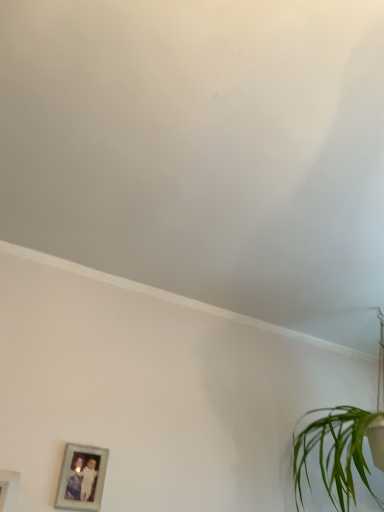
Locate an element on the screen. white matte picture frame at lower left, the 2th picture frame viewed from the back is located at coordinates (8, 489).

You are a GUI agent. You are given a task and a screenshot of the screen. Output one action in this format:
    pyautogui.click(x=<x>, y=<y>)
    Task: Click on the white matte wall at upper center
    This screenshot has height=512, width=384.
    Given the screenshot: What is the action you would take?
    pyautogui.click(x=204, y=151)

The image size is (384, 512). I want to click on silver metallic photo frame at lower left, the second picture frame from the front, so click(x=82, y=478).

Can you confirm if white matte wall at upper center is thinner than green leafy plant at lower right?

No.

Relative to green leafy plant at lower right, is white matte wall at upper center in front or behind?

Visually, white matte wall at upper center is located in front of green leafy plant at lower right.

Is point (169, 145) positioned after point (353, 500)?

That is False.

Is white matte wall at upper center aimed at green leafy plant at lower right?

No, white matte wall at upper center is not facing towards green leafy plant at lower right.

Is green leafy plant at lower right bigger or smaller than silver metallic photo frame at lower left, the second picture frame from the front?

Clearly, green leafy plant at lower right is larger in size than silver metallic photo frame at lower left, the second picture frame from the front.

Which is in front, green leafy plant at lower right or silver metallic photo frame at lower left, arranged as the 1th picture frame when viewed from the right?

green leafy plant at lower right.

Is point (373, 422) closer to viewer compared to point (87, 477)?

No, (373, 422) is further to viewer.

Would you say green leafy plant at lower right is a long distance from silver metallic photo frame at lower left, the first picture frame in the back-to-front sequence?

No, there isn't a large distance between green leafy plant at lower right and silver metallic photo frame at lower left, the first picture frame in the back-to-front sequence.

Is green leafy plant at lower right not close to white matte picture frame at lower left, which is counted as the 2th picture frame, starting from the right?

green leafy plant at lower right is far away from white matte picture frame at lower left, which is counted as the 2th picture frame, starting from the right.

Which of these two, green leafy plant at lower right or white matte picture frame at lower left, which is the first picture frame from front to back, stands taller?

green leafy plant at lower right is taller.

Image resolution: width=384 pixels, height=512 pixels. What are the coordinates of `houseplant on the right of white matte picture frame at lower left, which is counted as the 2th picture frame, starting from the right` in the screenshot? It's located at (342, 445).

Considering the relative sizes of green leafy plant at lower right and white matte picture frame at lower left, which is counted as the 2th picture frame, starting from the right, in the image provided, is green leafy plant at lower right smaller than white matte picture frame at lower left, which is counted as the 2th picture frame, starting from the right,?

Actually, green leafy plant at lower right might be larger than white matte picture frame at lower left, which is counted as the 2th picture frame, starting from the right.

Considering the sizes of white matte picture frame at lower left, the 1th picture frame from the left, and silver metallic photo frame at lower left, arranged as the 1th picture frame when viewed from the right, in the image, is white matte picture frame at lower left, the 1th picture frame from the left, taller or shorter than silver metallic photo frame at lower left, arranged as the 1th picture frame when viewed from the right,?

Considering their sizes, white matte picture frame at lower left, the 1th picture frame from the left, has more height than silver metallic photo frame at lower left, arranged as the 1th picture frame when viewed from the right.

Looking at the image, does white matte picture frame at lower left, the 1th picture frame from the left, seem bigger or smaller compared to silver metallic photo frame at lower left, the 2th picture frame in the left-to-right sequence?

Considering their sizes, white matte picture frame at lower left, the 1th picture frame from the left, takes up more space than silver metallic photo frame at lower left, the 2th picture frame in the left-to-right sequence.

Does point (9, 487) lie behind point (73, 472)?

No, it is not.

In the image, there is a silver metallic photo frame at lower left, arranged as the 1th picture frame when viewed from the right. Where is `picture frame below it (from the image's perspective)`? picture frame below it (from the image's perspective) is located at coordinates (8, 489).

Locate an element on the screen. The image size is (384, 512). houseplant on the right of white matte picture frame at lower left, the 1th picture frame from the left is located at coordinates (342, 445).

Is white matte picture frame at lower left, which is the first picture frame from front to back, smaller than green leafy plant at lower right?

Yes, white matte picture frame at lower left, which is the first picture frame from front to back, is smaller than green leafy plant at lower right.

Which is more distant, (x=2, y=490) or (x=370, y=446)?

The point (x=370, y=446) is more distant.

In the image, is white matte picture frame at lower left, which is the first picture frame from front to back, positioned in front of or behind green leafy plant at lower right?

white matte picture frame at lower left, which is the first picture frame from front to back, is in front of green leafy plant at lower right.

Could silver metallic photo frame at lower left, arranged as the 1th picture frame when viewed from the right, be considered to be inside white matte wall at upper center?

That's incorrect, silver metallic photo frame at lower left, arranged as the 1th picture frame when viewed from the right, is not inside white matte wall at upper center.

Can you confirm if white matte wall at upper center is thinner than silver metallic photo frame at lower left, arranged as the 1th picture frame when viewed from the right?

No, white matte wall at upper center is not thinner than silver metallic photo frame at lower left, arranged as the 1th picture frame when viewed from the right.

Based on the photo, considering the positions of objects white matte wall at upper center and silver metallic photo frame at lower left, the second picture frame from the front, in the image provided, who is in front, white matte wall at upper center or silver metallic photo frame at lower left, the second picture frame from the front,?

white matte wall at upper center is in front.

Is white matte wall at upper center facing towards silver metallic photo frame at lower left, arranged as the 1th picture frame when viewed from the right?

No, white matte wall at upper center is not turned towards silver metallic photo frame at lower left, arranged as the 1th picture frame when viewed from the right.

In the scene shown: From a real-world perspective, is green leafy plant at lower right below white matte wall at upper center?

Yes, from a real-world perspective, green leafy plant at lower right is below white matte wall at upper center.

Can you confirm if green leafy plant at lower right is positioned to the left of white matte wall at upper center?

Incorrect, green leafy plant at lower right is not on the left side of white matte wall at upper center.

From the image's perspective, would you say green leafy plant at lower right is positioned over white matte wall at upper center?

No, from the image's perspective, green leafy plant at lower right is not on top of white matte wall at upper center.

You are a GUI agent. You are given a task and a screenshot of the screen. Output one action in this format:
    pyautogui.click(x=<x>, y=<y>)
    Task: Click on the cloud above the green leafy plant at lower right (from the image's perspective)
    The width and height of the screenshot is (384, 512).
    Given the screenshot: What is the action you would take?
    pyautogui.click(x=204, y=151)

Where is `picture frame that is behind the green leafy plant at lower right`? picture frame that is behind the green leafy plant at lower right is located at coordinates (82, 478).

Estimate the real-world distances between objects in this image. Which object is closer to green leafy plant at lower right, white matte picture frame at lower left, which is the first picture frame from front to back, or silver metallic photo frame at lower left, the 2th picture frame in the left-to-right sequence?

Among the two, silver metallic photo frame at lower left, the 2th picture frame in the left-to-right sequence, is located nearer to green leafy plant at lower right.

From the image, which object appears to be farther from silver metallic photo frame at lower left, the first picture frame in the back-to-front sequence, green leafy plant at lower right or white matte picture frame at lower left, the 1th picture frame from the left?

green leafy plant at lower right lies further to silver metallic photo frame at lower left, the first picture frame in the back-to-front sequence, than the other object.

Estimate the real-world distances between objects in this image. Which object is further from white matte wall at upper center, silver metallic photo frame at lower left, arranged as the 1th picture frame when viewed from the right, or green leafy plant at lower right?

The object further to white matte wall at upper center is silver metallic photo frame at lower left, arranged as the 1th picture frame when viewed from the right.

Which object lies further to the anchor point silver metallic photo frame at lower left, the 2th picture frame in the left-to-right sequence, white matte wall at upper center or white matte picture frame at lower left, which is counted as the 2th picture frame, starting from the right?

The object further to silver metallic photo frame at lower left, the 2th picture frame in the left-to-right sequence, is white matte wall at upper center.

Based on their spatial positions, is green leafy plant at lower right or white matte picture frame at lower left, the 2th picture frame viewed from the back, closer to white matte wall at upper center?

green leafy plant at lower right lies closer to white matte wall at upper center than the other object.

From the image, which object appears to be nearer to white matte picture frame at lower left, the 2th picture frame viewed from the back, white matte wall at upper center or silver metallic photo frame at lower left, the second picture frame from the front?

silver metallic photo frame at lower left, the second picture frame from the front, lies closer to white matte picture frame at lower left, the 2th picture frame viewed from the back, than the other object.

Based on their spatial positions, is white matte wall at upper center or white matte picture frame at lower left, which is counted as the 2th picture frame, starting from the right, closer to green leafy plant at lower right?

Based on the image, white matte wall at upper center appears to be nearer to green leafy plant at lower right.

Which object lies nearer to the anchor point silver metallic photo frame at lower left, the first picture frame in the back-to-front sequence, white matte picture frame at lower left, the 1th picture frame from the left, or green leafy plant at lower right?

white matte picture frame at lower left, the 1th picture frame from the left, is positioned closer to the anchor silver metallic photo frame at lower left, the first picture frame in the back-to-front sequence.

Where is `picture frame between white matte picture frame at lower left, the 1th picture frame from the left, and green leafy plant at lower right from left to right`? The image size is (384, 512). picture frame between white matte picture frame at lower left, the 1th picture frame from the left, and green leafy plant at lower right from left to right is located at coordinates (82, 478).

At what (x,y) coordinates should I click in order to perform the action: click on cloud between silver metallic photo frame at lower left, arranged as the 1th picture frame when viewed from the right, and green leafy plant at lower right from left to right. Please return your answer as a coordinate pair (x, y). Looking at the image, I should click on (204, 151).

Find the location of a particular element. This screenshot has height=512, width=384. picture frame between white matte picture frame at lower left, which is counted as the 2th picture frame, starting from the right, and white matte wall at upper center from left to right is located at coordinates (82, 478).

Identify the location of cloud situated between white matte picture frame at lower left, the 1th picture frame from the left, and green leafy plant at lower right from left to right. (204, 151).